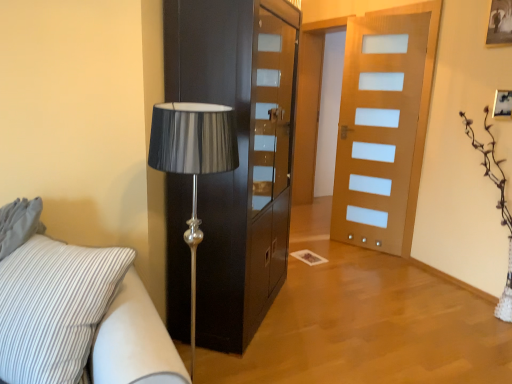
Question: From the image's perspective, does wooden door at center appear higher than white striped fabric studio couch at lower left?

Choices:
 (A) no
 (B) yes

Answer: (B)

Question: Is the depth of wooden door at center less than that of white striped fabric studio couch at lower left?

Choices:
 (A) yes
 (B) no

Answer: (B)

Question: Considering the relative sizes of wooden door at center and white striped fabric studio couch at lower left in the image provided, is wooden door at center thinner than white striped fabric studio couch at lower left?

Choices:
 (A) yes
 (B) no

Answer: (A)

Question: From a real-world perspective, is wooden door at center on white striped fabric studio couch at lower left?

Choices:
 (A) yes
 (B) no

Answer: (A)

Question: From a real-world perspective, is wooden door at center positioned under white striped fabric studio couch at lower left based on gravity?

Choices:
 (A) no
 (B) yes

Answer: (A)

Question: Is wooden door at center taller or shorter than black glossy cabinet at center?

Choices:
 (A) tall
 (B) short

Answer: (A)

Question: Would you say wooden door at center is to the left or to the right of black glossy cabinet at center in the picture?

Choices:
 (A) right
 (B) left

Answer: (A)

Question: Is wooden door at center spatially inside black glossy cabinet at center, or outside of it?

Choices:
 (A) outside
 (B) inside

Answer: (A)

Question: Looking at the image, does wooden door at center seem bigger or smaller compared to black glossy cabinet at center?

Choices:
 (A) big
 (B) small

Answer: (B)

Question: Considering their positions, is white striped fabric studio couch at lower left located in front of or behind wooden picture frame at upper right?

Choices:
 (A) front
 (B) behind

Answer: (A)

Question: Considering the relative positions of white striped fabric studio couch at lower left and wooden picture frame at upper right in the image provided, is white striped fabric studio couch at lower left to the left or to the right of wooden picture frame at upper right?

Choices:
 (A) left
 (B) right

Answer: (A)

Question: Considering the positions of white striped fabric studio couch at lower left and wooden picture frame at upper right in the image, is white striped fabric studio couch at lower left wider or thinner than wooden picture frame at upper right?

Choices:
 (A) thin
 (B) wide

Answer: (B)

Question: Is point (39, 200) positioned closer to the camera than point (502, 114)?

Choices:
 (A) closer
 (B) farther

Answer: (A)

Question: From the image's perspective, is white striped fabric studio couch at lower left positioned above or below black glossy cabinet at center?

Choices:
 (A) above
 (B) below

Answer: (B)

Question: In terms of width, does white striped fabric studio couch at lower left look wider or thinner when compared to black glossy cabinet at center?

Choices:
 (A) thin
 (B) wide

Answer: (B)